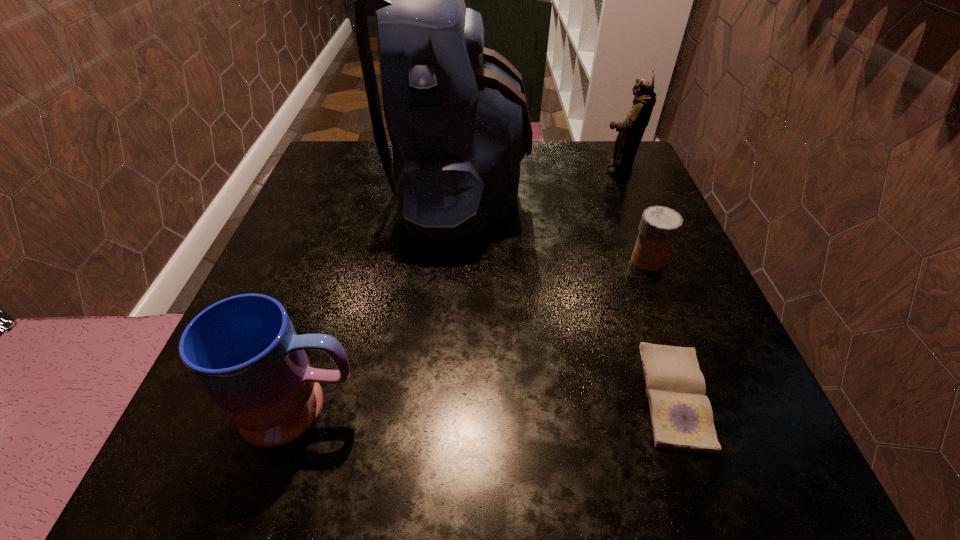
At what (x,y) coordinates should I click in order to perform the action: click on free space between the medicine and the figurine. Please return your answer as a coordinate pair (x, y). Looking at the image, I should click on (633, 215).

Locate an element on the screen. The image size is (960, 540). free area in between the third tallest object and the medicine is located at coordinates (475, 334).

Point out which object is positioned as the second nearest to the figurine. Please provide its 2D coordinates. Your answer should be formatted as a tuple, i.e. [(x, y)], where the tuple contains the x and y coordinates of a point satisfying the conditions above.

[(659, 227)]

Locate which object is the fourth closest to the third shortest object. Please provide its 2D coordinates. Your answer should be formatted as a tuple, i.e. [(x, y)], where the tuple contains the x and y coordinates of a point satisfying the conditions above.

[(631, 130)]